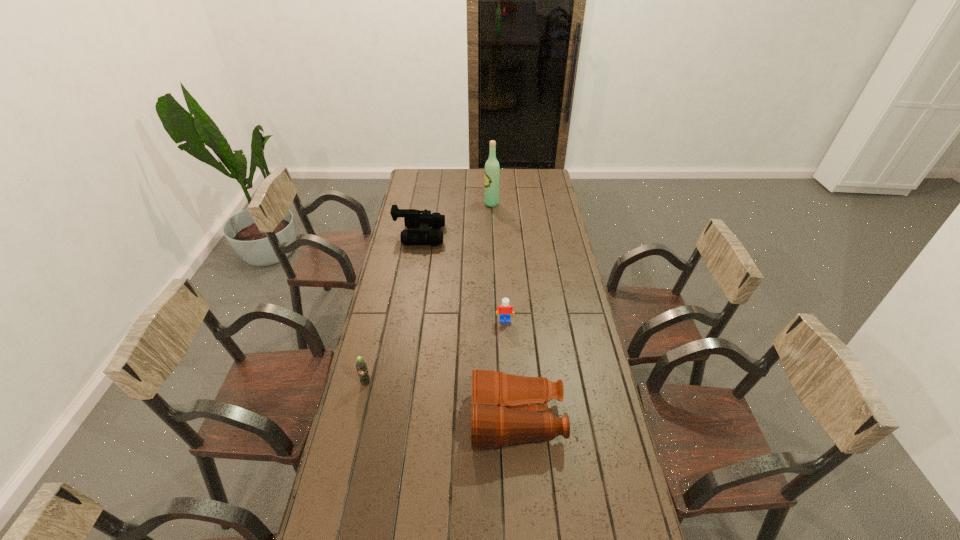
In order to click on free location located 0.320m on the front-facing side of the farthest object in this screenshot , I will do `click(425, 204)`.

You are a GUI agent. You are given a task and a screenshot of the screen. Output one action in this format:
    pyautogui.click(x=<x>, y=<y>)
    Task: Click on the free space located 0.150m on the front lenses of the fourth nearest object
    
    Given the screenshot: What is the action you would take?
    pyautogui.click(x=474, y=235)

Identify the location of free space located 0.110m through the lenses of the nearer binoculars. (438, 420).

Locate an element on the screen. This screenshot has height=540, width=960. free point located through the lenses of the nearer binoculars is located at coordinates (438, 420).

This screenshot has width=960, height=540. I want to click on vacant space located through the lenses of the nearer binoculars, so click(362, 420).

You are a GUI agent. You are given a task and a screenshot of the screen. Output one action in this format:
    pyautogui.click(x=<x>, y=<y>)
    Task: Click on the free space located 0.130m on the front label of the soda
    The height and width of the screenshot is (540, 960).
    Given the screenshot: What is the action you would take?
    pyautogui.click(x=357, y=422)

Find the location of a particular element. The width and height of the screenshot is (960, 540). free region located 0.310m on the face of the shortest object is located at coordinates (509, 390).

Locate an element on the screen. This screenshot has width=960, height=540. binoculars positioned at the left edge is located at coordinates (413, 219).

This screenshot has height=540, width=960. Find the location of `soda positioned at the left edge`. soda positioned at the left edge is located at coordinates (361, 365).

The image size is (960, 540). Find the location of `object that is positioned at the right edge`. object that is positioned at the right edge is located at coordinates (497, 420).